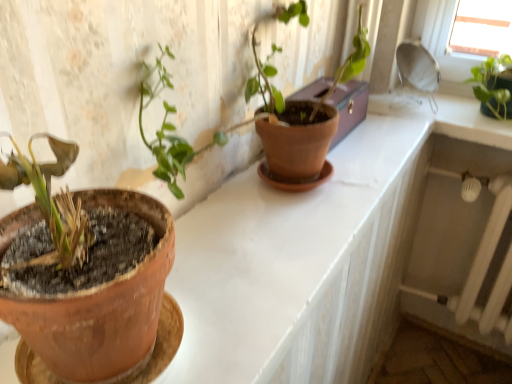
Question: Considering the relative sizes of green matte plant at upper right and matte terracotta pot at center in the image provided, is green matte plant at upper right taller than matte terracotta pot at center?

Choices:
 (A) no
 (B) yes

Answer: (B)

Question: Can you confirm if green matte plant at upper right is shorter than matte terracotta pot at center?

Choices:
 (A) no
 (B) yes

Answer: (A)

Question: Is green matte plant at upper right outside matte terracotta pot at center?

Choices:
 (A) yes
 (B) no

Answer: (A)

Question: Is the depth of green matte plant at upper right less than that of matte terracotta pot at center?

Choices:
 (A) yes
 (B) no

Answer: (B)

Question: Does green matte plant at upper right appear on the left side of matte terracotta pot at center?

Choices:
 (A) yes
 (B) no

Answer: (B)

Question: In terms of height, does terracotta clay pot at left look taller or shorter compared to brown leather box at upper center?

Choices:
 (A) short
 (B) tall

Answer: (B)

Question: Is terracotta clay pot at left wider or thinner than brown leather box at upper center?

Choices:
 (A) wide
 (B) thin

Answer: (A)

Question: Does point (122, 278) appear closer or farther from the camera than point (321, 87)?

Choices:
 (A) farther
 (B) closer

Answer: (B)

Question: Do you think terracotta clay pot at left is within brown leather box at upper center, or outside of it?

Choices:
 (A) outside
 (B) inside

Answer: (A)

Question: Is terracotta clay pot at left to the left or to the right of green matte plant at upper right in the image?

Choices:
 (A) right
 (B) left

Answer: (B)

Question: From the image's perspective, is terracotta clay pot at left positioned above or below green matte plant at upper right?

Choices:
 (A) below
 (B) above

Answer: (A)

Question: Is terracotta clay pot at left in front of or behind green matte plant at upper right in the image?

Choices:
 (A) front
 (B) behind

Answer: (A)

Question: From a real-world perspective, relative to green matte plant at upper right, is terracotta clay pot at left vertically above or below?

Choices:
 (A) above
 (B) below

Answer: (A)

Question: Considering the relative positions of matte terracotta pot at center and terracotta clay pot at left in the image provided, is matte terracotta pot at center to the left or to the right of terracotta clay pot at left?

Choices:
 (A) left
 (B) right

Answer: (B)

Question: Is point (364, 162) positioned closer to the camera than point (106, 349)?

Choices:
 (A) farther
 (B) closer

Answer: (A)